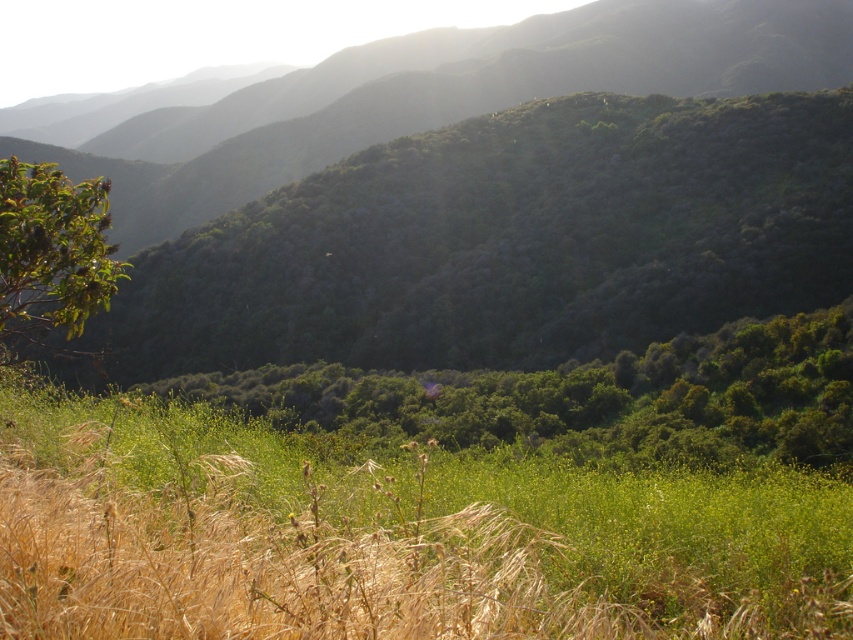
Consider the image. You are standing in the field of tall grass and want to walk towards the green leafy trees at center. Which direction should you head relative to the green leafy tree at left?

You should head to the right relative to the green leafy tree at left because the green leafy trees at center is positioned to the right of it.

You are standing at the point marked by the coordinate point (387, 536) in the image. Looking around, what type of terrain do you see immediately around you?

The point (387, 536) marks green grassy field at lower center, so you are standing in a green grassy field at lower center.

You are standing at the point marked as point (x=590, y=397) in the image. What do you see directly in front of you?

At point (x=590, y=397) lies green leafy trees at center, so you would see green leafy trees at center directly in front of you.